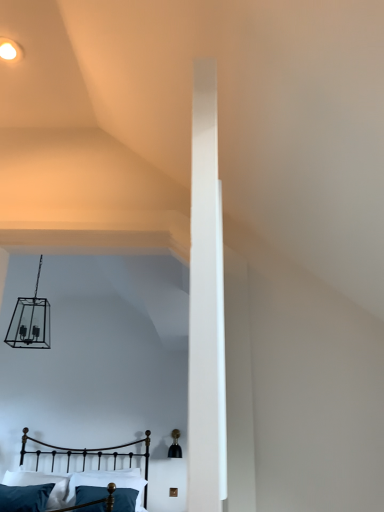
Question: From a real-world perspective, is velvety teal pillow at lower left, which is counted as the first pillow, starting from the left, located beneath metallic black bed at lower left?

Choices:
 (A) no
 (B) yes

Answer: (B)

Question: Can you confirm if velvety teal pillow at lower left, which is the second pillow in right-to-left order, is smaller than metallic black bed at lower left?

Choices:
 (A) yes
 (B) no

Answer: (A)

Question: Is velvety teal pillow at lower left, which is counted as the first pillow, starting from the left, further to camera compared to metallic black bed at lower left?

Choices:
 (A) yes
 (B) no

Answer: (A)

Question: Does velvety teal pillow at lower left, which is counted as the first pillow, starting from the left, have a lesser height compared to metallic black bed at lower left?

Choices:
 (A) no
 (B) yes

Answer: (B)

Question: Does velvety teal pillow at lower left, which is the second pillow in right-to-left order, come in front of metallic black bed at lower left?

Choices:
 (A) no
 (B) yes

Answer: (A)

Question: From the image's perspective, is teal fabric pillow at lower center, which appears as the second pillow when viewed from the left, positioned above or below velvety teal pillow at lower left, which is counted as the first pillow, starting from the left?

Choices:
 (A) above
 (B) below

Answer: (B)

Question: Considering their positions, is teal fabric pillow at lower center, which appears as the second pillow when viewed from the left, located in front of or behind velvety teal pillow at lower left, which is the second pillow in right-to-left order?

Choices:
 (A) front
 (B) behind

Answer: (B)

Question: Is teal fabric pillow at lower center, acting as the 1th pillow starting from the right, wider or thinner than velvety teal pillow at lower left, which is the second pillow in right-to-left order?

Choices:
 (A) thin
 (B) wide

Answer: (A)

Question: Does point (117, 493) appear closer or farther from the camera than point (18, 483)?

Choices:
 (A) farther
 (B) closer

Answer: (B)

Question: Looking at the image, does metallic black bed at lower left seem bigger or smaller compared to matte white ceiling light at upper left?

Choices:
 (A) big
 (B) small

Answer: (A)

Question: In terms of width, does metallic black bed at lower left look wider or thinner when compared to matte white ceiling light at upper left?

Choices:
 (A) thin
 (B) wide

Answer: (B)

Question: In the image, is metallic black bed at lower left on the left side or the right side of matte white ceiling light at upper left?

Choices:
 (A) left
 (B) right

Answer: (A)

Question: Which is correct: metallic black bed at lower left is inside matte white ceiling light at upper left, or outside of it?

Choices:
 (A) inside
 (B) outside

Answer: (B)

Question: Is matte white ceiling light at upper left spatially inside metallic black bed at lower left, or outside of it?

Choices:
 (A) outside
 (B) inside

Answer: (A)

Question: Is matte white ceiling light at upper left wider or thinner than metallic black bed at lower left?

Choices:
 (A) wide
 (B) thin

Answer: (B)